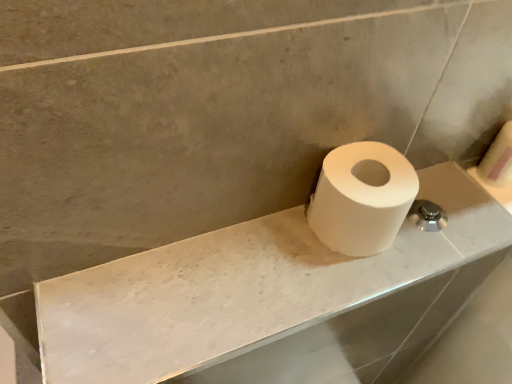
The image size is (512, 384). In order to click on vacant space in front of white matte toilet paper at right, positioned as the 2th toilet paper in back-to-front order in this screenshot , I will do `click(323, 293)`.